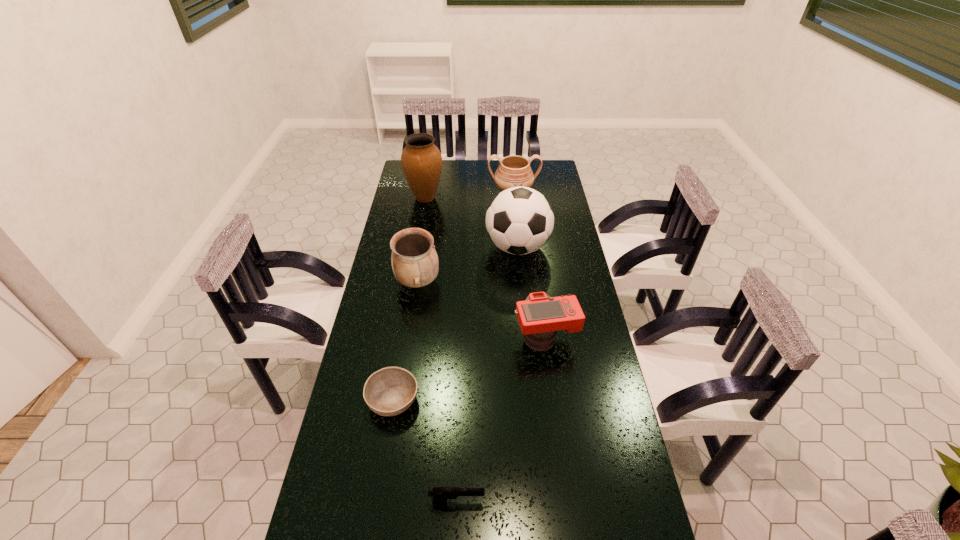
Find the location of a particular element. the tallest urn is located at coordinates (421, 161).

Find the location of a particular element. This screenshot has width=960, height=540. soccer ball is located at coordinates pos(519,220).

Identify the location of the rightmost urn. (514, 171).

The image size is (960, 540). In order to click on the nearest urn in this screenshot , I will do `click(414, 260)`.

You are a GUI agent. You are given a task and a screenshot of the screen. Output one action in this format:
    pyautogui.click(x=<x>, y=<y>)
    Task: Click on the fifth tallest object
    
    Given the screenshot: What is the action you would take?
    pyautogui.click(x=540, y=316)

Image resolution: width=960 pixels, height=540 pixels. I want to click on the fifth farthest object, so click(x=540, y=316).

Find the location of `the fourth object from left to right`. the fourth object from left to right is located at coordinates (440, 495).

Locate an element on the screen. The height and width of the screenshot is (540, 960). the nearest object is located at coordinates (440, 495).

Image resolution: width=960 pixels, height=540 pixels. Find the location of `the shortest object`. the shortest object is located at coordinates (390, 391).

Find the location of a particular element. This screenshot has width=960, height=540. bowl is located at coordinates (390, 391).